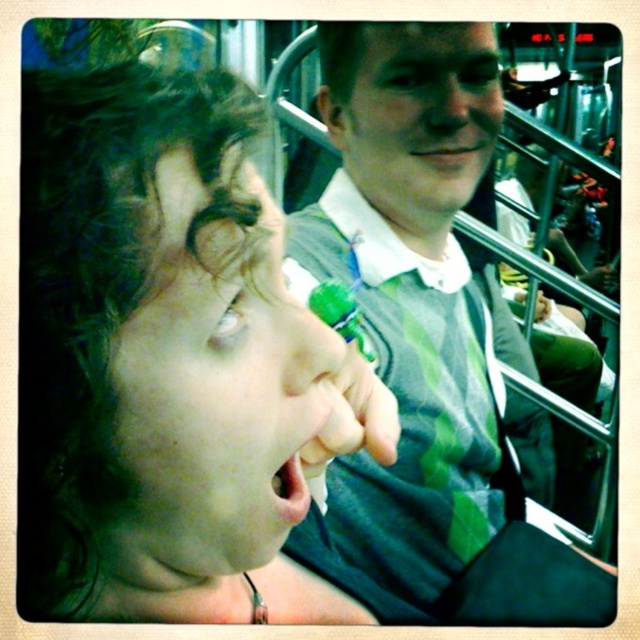
Who is more distant from viewer, (45, 109) or (474, 410)?

The point (474, 410) is behind.

Looking at this image, can you confirm if matte green bottle at center is bigger than green striped shirt at center?

Incorrect, matte green bottle at center is not larger than green striped shirt at center.

Where is `matte green bottle at center`? The width and height of the screenshot is (640, 640). matte green bottle at center is located at coordinates (168, 360).